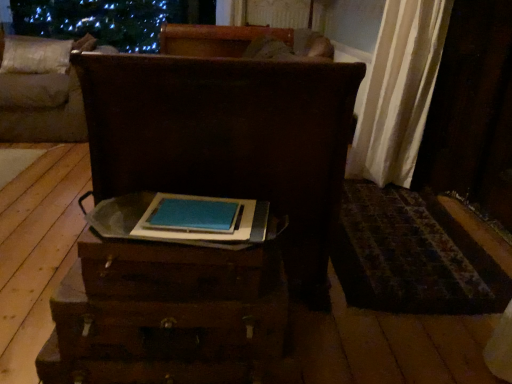
Locate an element on the screen. free region on the left part of blue matte book at center is located at coordinates (117, 217).